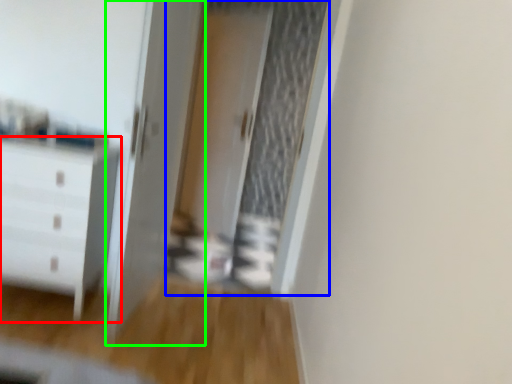
Question: Considering the real-world distances, which object is farthest from chest of drawers (highlighted by a red box)? screen door (highlighted by a blue box) or door (highlighted by a green box)?

Choices:
 (A) screen door
 (B) door

Answer: (A)